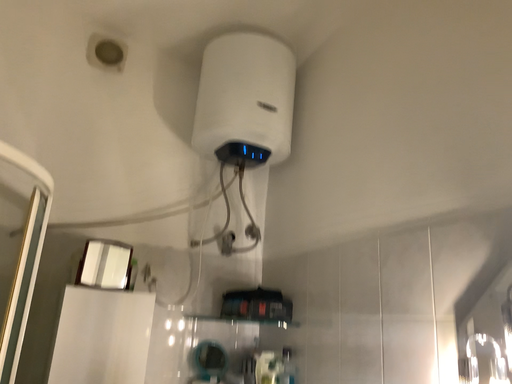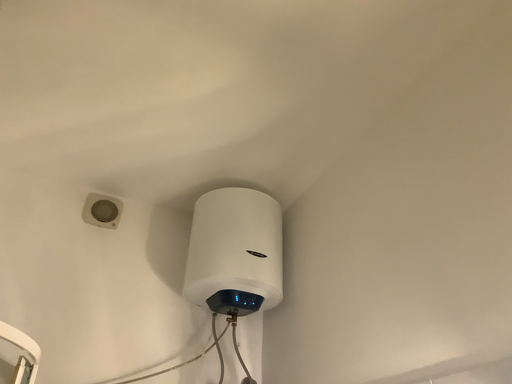
Question: Which way did the camera rotate in the video?

Choices:
 (A) rotated downward
 (B) rotated upward

Answer: (B)